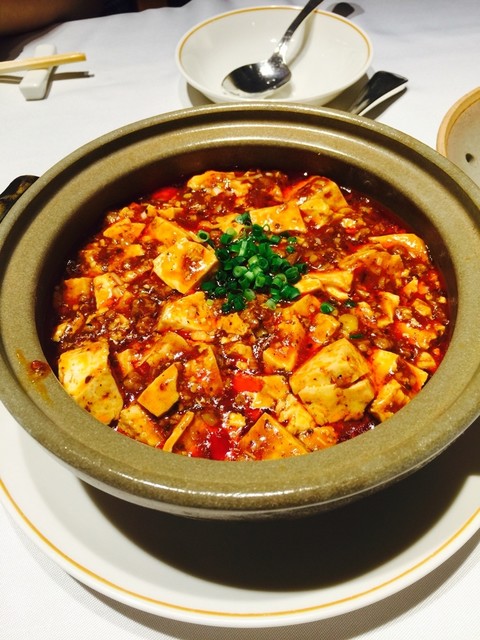
Where is `white bowl`? Image resolution: width=480 pixels, height=640 pixels. white bowl is located at coordinates (339, 36).